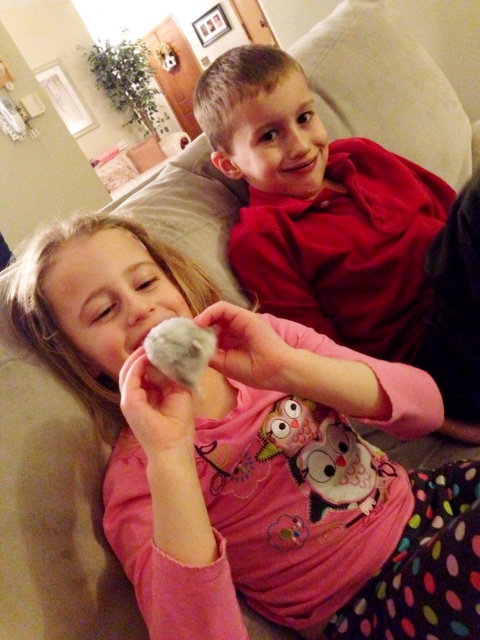
This screenshot has width=480, height=640. What do you see at coordinates (251, 456) in the screenshot?
I see `fluffy pink owl at center` at bounding box center [251, 456].

Find the location of a particular element. Image resolution: width=480 pixels, height=640 pixels. fluffy pink owl at center is located at coordinates (251, 456).

Image resolution: width=480 pixels, height=640 pixels. What do you see at coordinates (320, 209) in the screenshot? I see `matte red shirt at upper right` at bounding box center [320, 209].

Which is more to the right, matte red shirt at upper right or fluffy white paw at center?

matte red shirt at upper right is more to the right.

This screenshot has height=640, width=480. Describe the element at coordinates (320, 209) in the screenshot. I see `matte red shirt at upper right` at that location.

You are a GUI agent. You are given a task and a screenshot of the screen. Output one action in this format:
    pyautogui.click(x=<x>, y=<y>)
    Task: Click on the matte red shirt at upper right
    The image size is (480, 640).
    Given the screenshot: What is the action you would take?
    pyautogui.click(x=320, y=209)

Which of these two, fluffy pink owl at center or fluffy white paw at center, stands shorter?

Standing shorter between the two is fluffy white paw at center.

Does point (41, 333) come behind point (184, 321)?

Yes, it is behind point (184, 321).

Is point (240, 566) closer to camera compared to point (179, 326)?

No, (240, 566) is behind (179, 326).

At what (x,y) coordinates should I click in order to perform the action: click on fluffy pink owl at center. Please return your answer as a coordinate pair (x, y). Looking at the image, I should click on (251, 456).